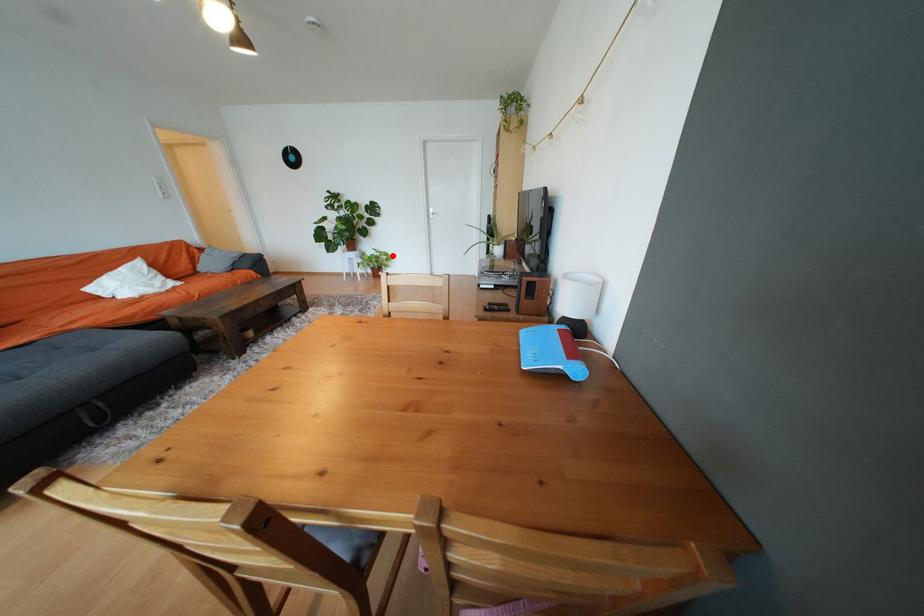
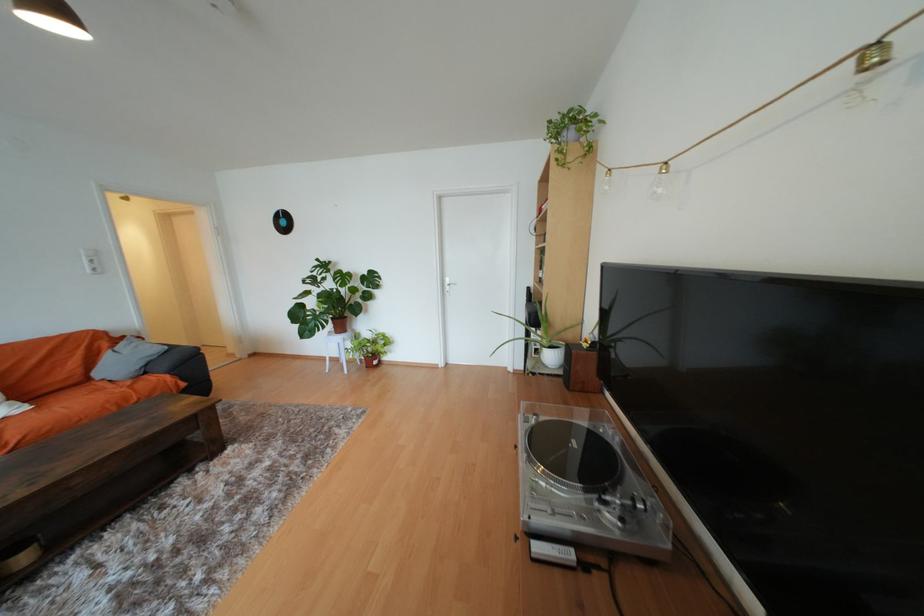
In the second image, find the point that corresponds to the highlighted location in the first image.

(391, 339)